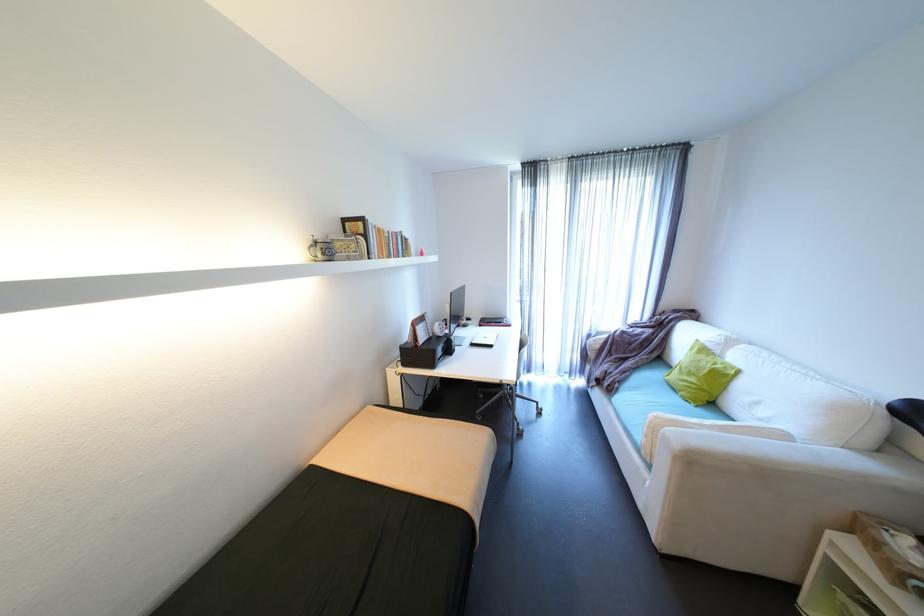
Where would you lift the white cylindrical pillow? Please return your answer as a coordinate pair (x, y).

(800, 402)